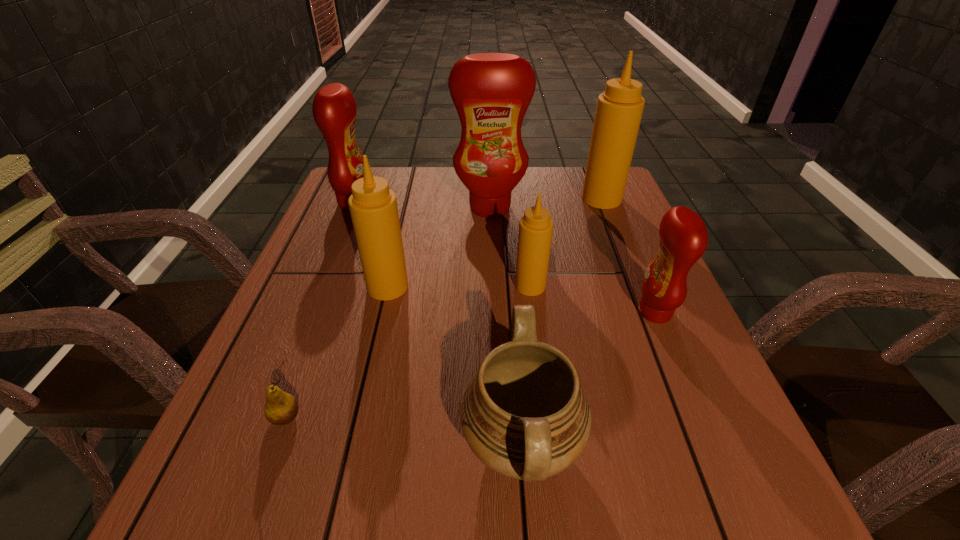
The width and height of the screenshot is (960, 540). I want to click on free region at the near edge, so click(x=632, y=537).

Where is `vacant position at the left edge of the desktop`? vacant position at the left edge of the desktop is located at coordinates (286, 372).

Locate an element on the screen. Image resolution: width=960 pixels, height=540 pixels. vacant region at the right edge of the desktop is located at coordinates (597, 224).

Identify the location of free space between the pear and the farthest tan condiment. This screenshot has height=540, width=960. (444, 308).

Locate an element on the screen. free area in between the biggest red condiment and the urn is located at coordinates (506, 326).

In order to click on vacant space that is in between the second red condiment from left to right and the leftmost condiment in this screenshot , I will do `click(422, 205)`.

You are a GUI agent. You are given a task and a screenshot of the screen. Output one action in this format:
    pyautogui.click(x=<x>, y=<y>)
    Task: Click on the free space that is in between the pear and the rightmost red condiment
    The width and height of the screenshot is (960, 540).
    Given the screenshot: What is the action you would take?
    pyautogui.click(x=470, y=364)

Locate an element on the screen. vacant region between the nearest red condiment and the second tan condiment from left to right is located at coordinates (592, 299).

This screenshot has height=540, width=960. Find the location of `free space between the leftmost condiment and the pear`. free space between the leftmost condiment and the pear is located at coordinates (321, 310).

Locate an element on the screen. vacant space that's between the urn and the smallest red condiment is located at coordinates (588, 378).